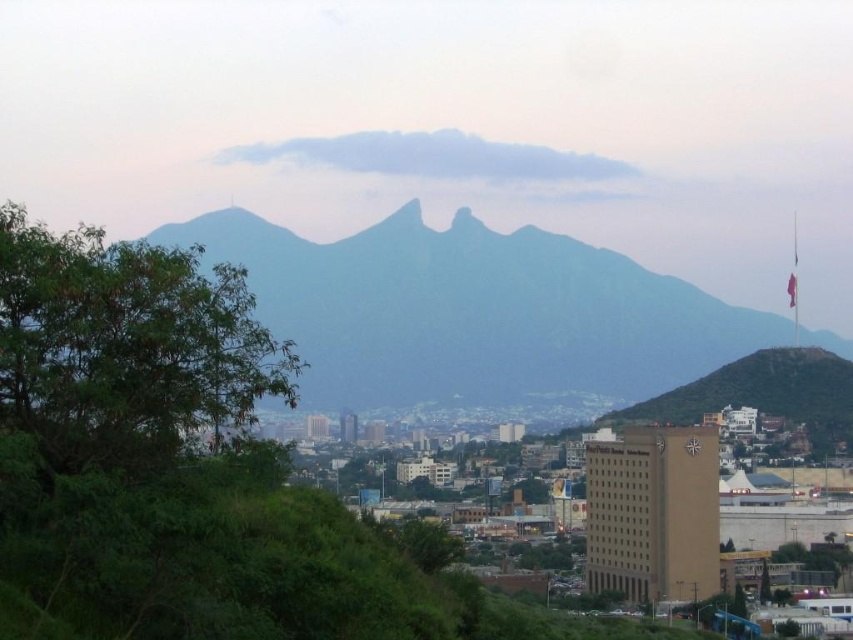
Does gray rock formation at center have a larger size compared to green leafy tree at left?

Yes, gray rock formation at center is bigger than green leafy tree at left.

Which is in front, point (282, 269) or point (126, 253)?

Point (282, 269) is in front.

In order to click on gray rock formation at center in this screenshot , I will do `click(473, 314)`.